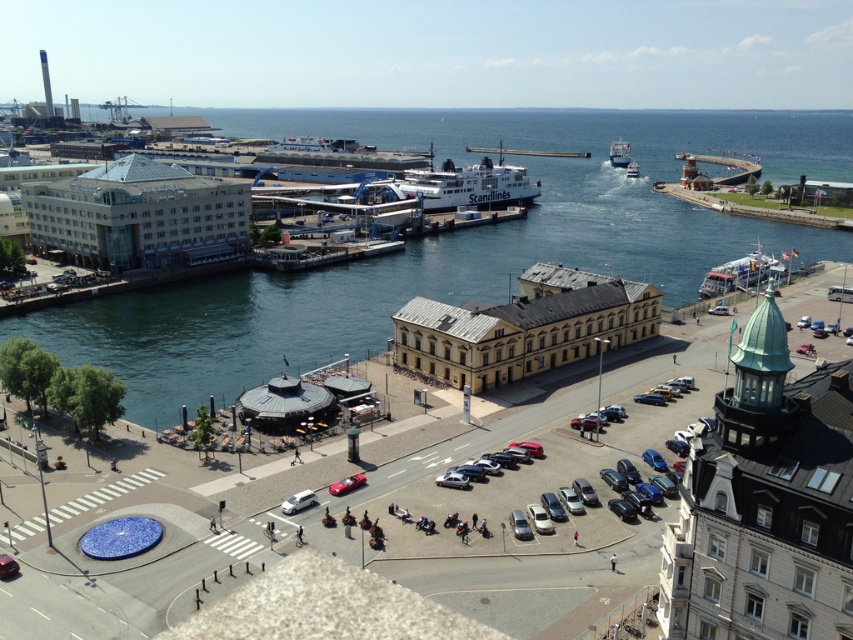
Question: Is blue water at center smaller than white glossy ferry at right?

Choices:
 (A) no
 (B) yes

Answer: (A)

Question: Considering the real-world distances, which object is farthest from the white matte van at center?

Choices:
 (A) blue water at center
 (B) shiny red car at center

Answer: (A)

Question: Which point is farther from the camera taking this photo?

Choices:
 (A) (305, 490)
 (B) (599, 124)
 (C) (630, 168)

Answer: (B)

Question: Which object is positioned closest to the white matte van at center?

Choices:
 (A) white glossy ferry at right
 (B) shiny red car at center
 (C) blue water at center
 (D) white plastic boat at center

Answer: (B)

Question: Does shiny red car at center appear on the left side of white plastic boat at center?

Choices:
 (A) no
 (B) yes

Answer: (B)

Question: Can you confirm if white matte van at center is thinner than shiny red car at center?

Choices:
 (A) yes
 (B) no

Answer: (B)